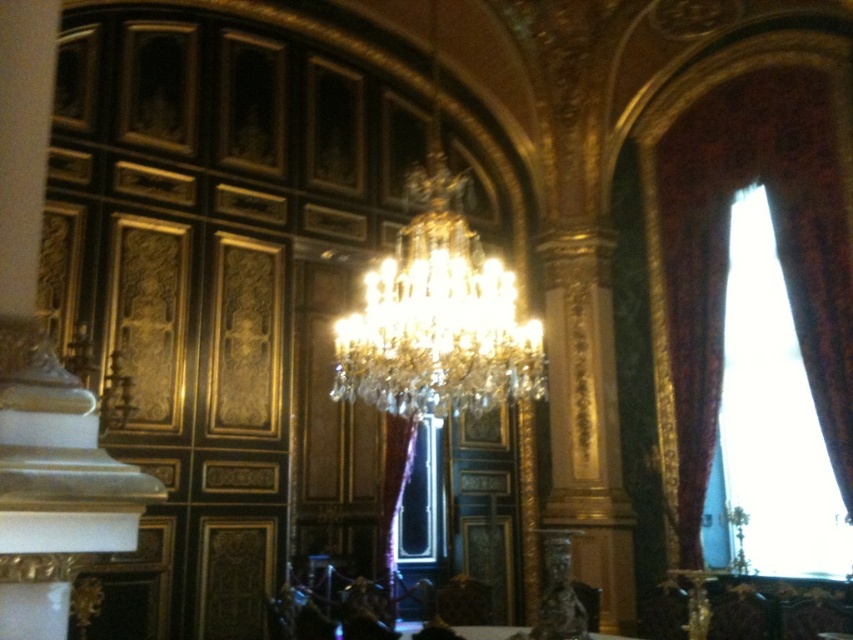
You are a decorator trying to place a floor lamp in this room. The floor lamp is 1.8 meters tall. You want to place it near the white glossy table at lower center without blocking the view of the velvet drapery at right. Can the lamp be placed there?

The velvet drapery at right is much taller than the white glossy table at lower center. Since the drapery is taller, placing the 1.8m lamp near the table won

You are standing in the center of the room and want to open the window to let in more light. Since the velvet drapery at right and the clear crystal chandelier at center are in your way, which one do you need to move first to access the window?

The velvet drapery at right is to the right of the clear crystal chandelier at center, so you need to move the velvet drapery at right first to access the window.

Consider the image. You are a tour guide leading a group through this grand room. You want to ensure a wheelchair user can navigate between the velvet drapery at right and the white glossy table at lower center. The wheelchair has a turning radius of 0.5 meters. Based on the space provided, can the wheelchair user comfortably move between these two points?

The distance between the velvet drapery at right and the white glossy table at lower center is 3.99 meters. Since the wheelchair requires a turning radius of only 0.5 meters, which is much smaller than the available space, the wheelchair user can comfortably navigate between these two points.